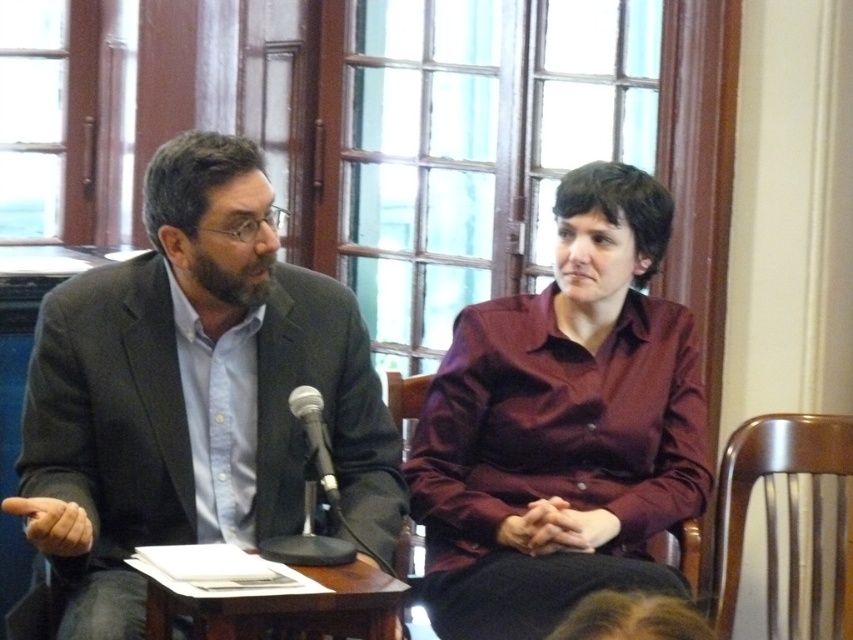
Based on the photo, you are a photographer setting up for a portrait session. You need to place a large camera tripod between the wooden chair at right and the brown wooden table at center. Can the tripod be placed there without overlapping either object?

The wooden chair at right is positioned over the brown wooden table at center, meaning they occupy the same space. Therefore, there is no available space between them to place the tripod without overlapping either object.

You are an event organizer arranging chairs for a small audience. You need to place a chair for someone who must sit to the right of the matte black suit at left but still within the same row as the black metallic microphone at center. Is this possible?

The matte black suit at left is to the left of the black metallic microphone at center, so placing a chair to the right of the matte black suit at left but within the same row as the black metallic microphone at center is possible as long as it is positioned between them or to the right of the microphone.